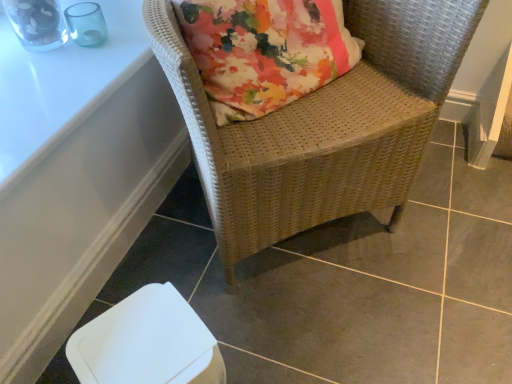
Identify the location of vacant space in front of woven wicker chair at upper right. (332, 321).